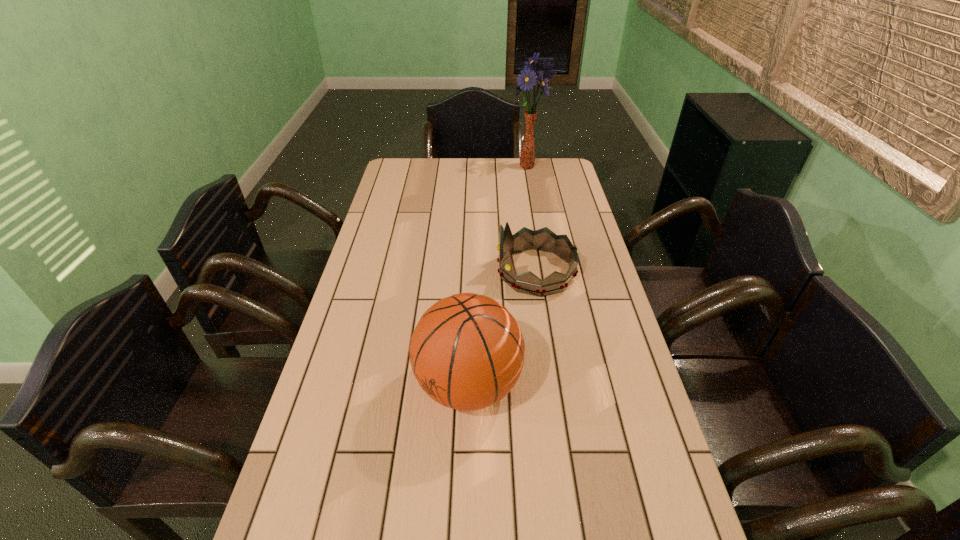
The width and height of the screenshot is (960, 540). What are the coordinates of `the farthest object` in the screenshot? It's located at (540, 71).

This screenshot has height=540, width=960. Identify the location of flower arrangement. (540, 71).

This screenshot has width=960, height=540. Identify the location of the nearest object. (467, 351).

At what (x,y) coordinates should I click in order to perform the action: click on basketball. Please return your answer as a coordinate pair (x, y). The image size is (960, 540). Looking at the image, I should click on (467, 351).

In order to click on the shortest object in this screenshot , I will do [x=544, y=239].

The image size is (960, 540). I want to click on tiara, so click(544, 239).

Identify the location of vacant space situated on the front of the farthest object. (532, 202).

Locate an element on the screen. The height and width of the screenshot is (540, 960). free space located 0.170m on the back of the basketball is located at coordinates (470, 298).

Locate an element on the screen. The width and height of the screenshot is (960, 540). free spot located 0.340m at the front of the tiara with jewels is located at coordinates (382, 272).

Identify the location of vacant space located at the front of the tiara with jewels. (405, 272).